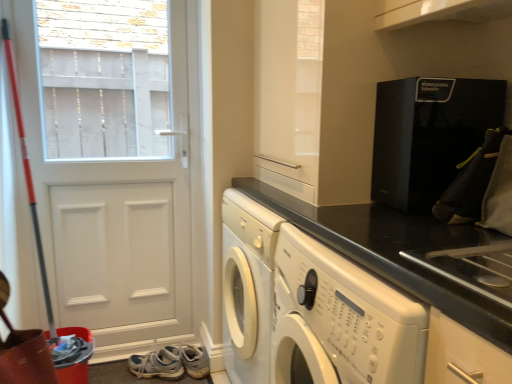
Locate an element on the screen. Image resolution: width=512 pixels, height=384 pixels. blank space to the left of white leather shoe at lower left is located at coordinates (122, 369).